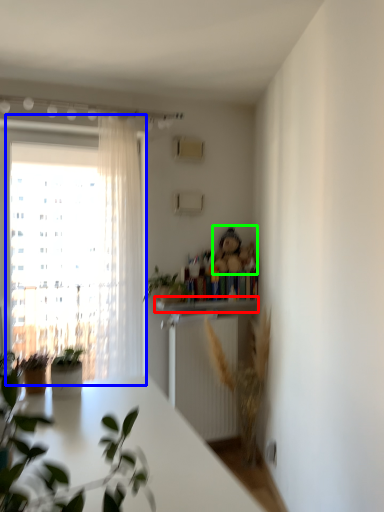
Question: Which is nearer to the window sill (highlighted by a red box)? window (highlighted by a blue box) or toy (highlighted by a green box).

Choices:
 (A) window
 (B) toy

Answer: (B)